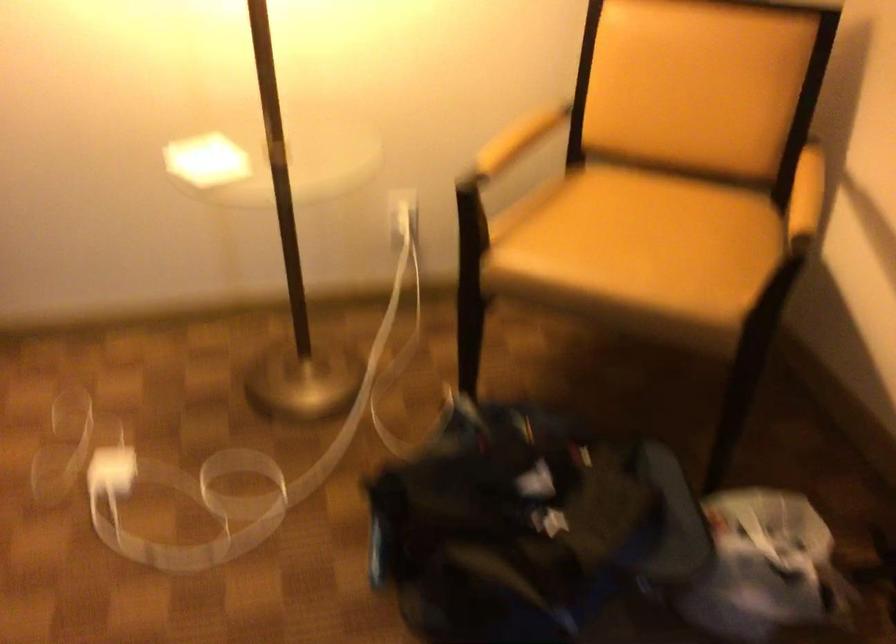
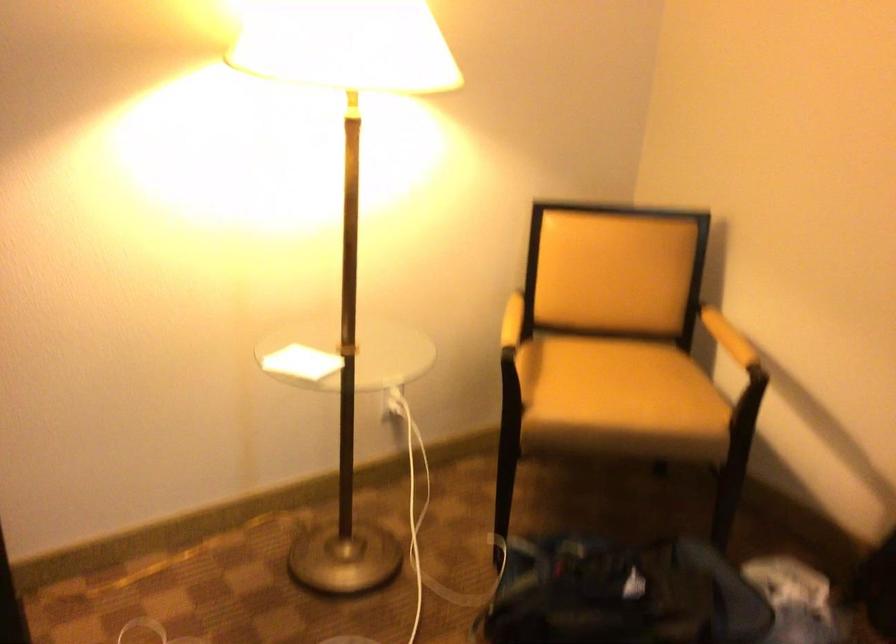
Find the pixel in the second image that matches (507,136) in the first image.

(512, 321)